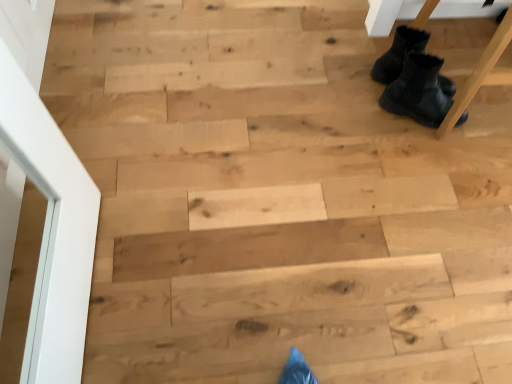
Question: In the image, is black suede boots at upper right, placed as the second footwear when sorted from bottom to top, positioned in front of or behind black fuzzy boots at upper right, positioned as the 1th footwear in bottom-to-top order?

Choices:
 (A) behind
 (B) front

Answer: (A)

Question: Is black suede boots at upper right, the 1th footwear from the top, inside the boundaries of black fuzzy boots at upper right, positioned as the 1th footwear in bottom-to-top order, or outside?

Choices:
 (A) inside
 (B) outside

Answer: (B)

Question: In terms of width, does black suede boots at upper right, placed as the second footwear when sorted from bottom to top, look wider or thinner when compared to black fuzzy boots at upper right, positioned as the 1th footwear in bottom-to-top order?

Choices:
 (A) thin
 (B) wide

Answer: (A)

Question: From a real-world perspective, relative to black suede boots at upper right, the 1th footwear from the top, is black fuzzy boots at upper right, positioned as the 1th footwear in bottom-to-top order, vertically above or below?

Choices:
 (A) below
 (B) above

Answer: (A)

Question: Is point (411, 66) closer or farther from the camera than point (385, 61)?

Choices:
 (A) closer
 (B) farther

Answer: (A)

Question: Relative to black suede boots at upper right, the 1th footwear from the top, is black fuzzy boots at upper right, arranged as the 2th footwear when viewed from the top, in front or behind?

Choices:
 (A) behind
 (B) front

Answer: (B)

Question: In the image, is black fuzzy boots at upper right, positioned as the 1th footwear in bottom-to-top order, on the left side or the right side of black suede boots at upper right, the 1th footwear from the top?

Choices:
 (A) left
 (B) right

Answer: (B)